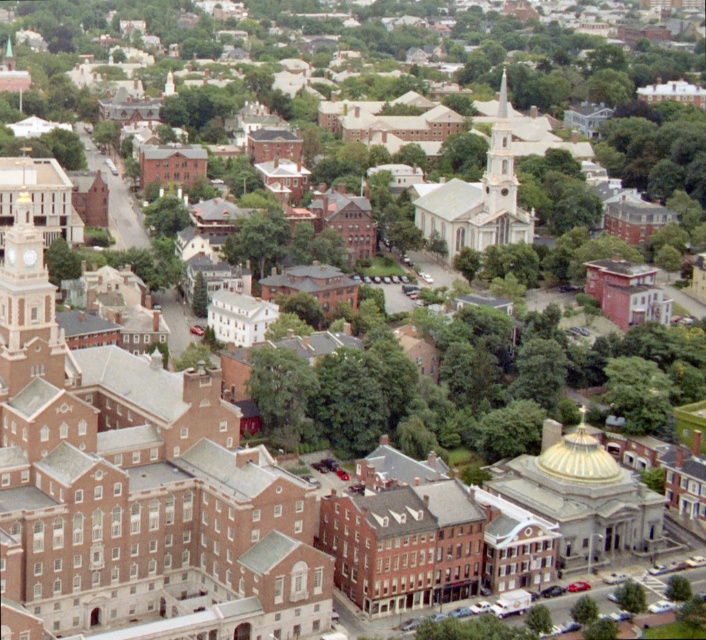
You are a drone operator flying a drone over the urban area shown in the image. You need to deliver a package to the point at coordinates point [35,243] and point [630,588]. Which point is closer to your current position at the camera position?

Point [35,243] is closer to the camera position than point [630,588] because it is further to the camera.

You are a drone operator who needs to deliver a package to the point marked at coordinates [28,308]. According to the image, where exactly is this point located?

The point is located on the matte brick clock tower at left.